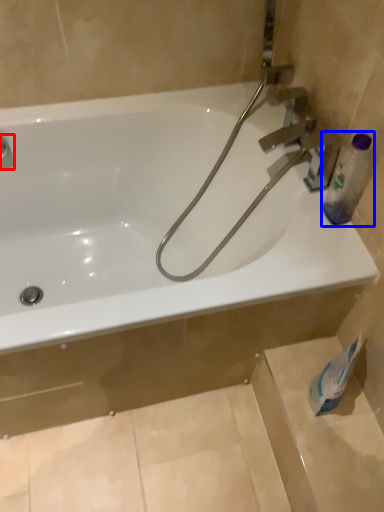
Question: Which of the following is the farthest to the observer, plumbing fixture (highlighted by a red box) or bottle (highlighted by a blue box)?

Choices:
 (A) plumbing fixture
 (B) bottle

Answer: (A)